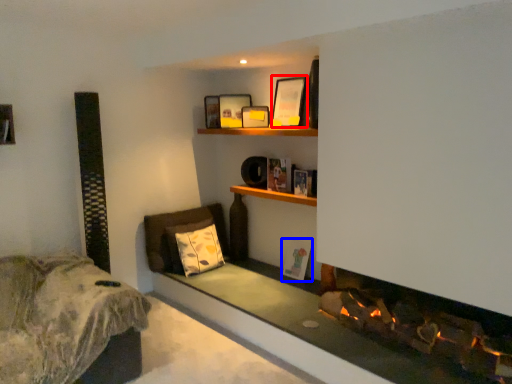
Question: Which of the following is the farthest to the observer, picture frame (highlighted by a red box) or picture frame (highlighted by a blue box)?

Choices:
 (A) picture frame
 (B) picture frame

Answer: (B)